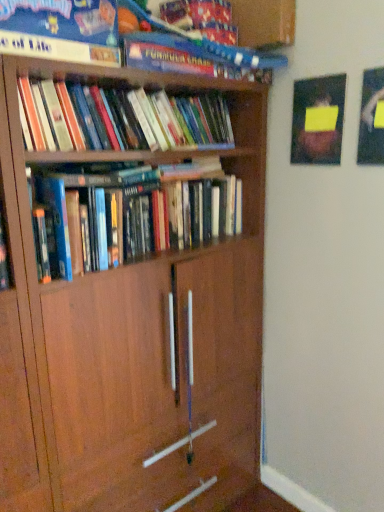
Question: Which direction should I rotate to face hardcover books at center, which is the third book in top-to-bottom order, — up or down?

Choices:
 (A) down
 (B) up

Answer: (B)

Question: Can you confirm if hardcover book at upper center, which is the 1th book in top-to-bottom order, is positioned to the right of hardcover books at upper left, which is counted as the second book, starting from the top?

Choices:
 (A) no
 (B) yes

Answer: (B)

Question: Are hardcover book at upper center, the third book in the bottom-to-top sequence, and hardcover books at upper left, the second book in the bottom-to-top sequence, far apart?

Choices:
 (A) yes
 (B) no

Answer: (B)

Question: Considering the relative sizes of hardcover book at upper center, the third book in the bottom-to-top sequence, and hardcover books at upper left, the second book in the bottom-to-top sequence, in the image provided, is hardcover book at upper center, the third book in the bottom-to-top sequence, smaller than hardcover books at upper left, the second book in the bottom-to-top sequence,?

Choices:
 (A) no
 (B) yes

Answer: (A)

Question: Considering the relative sizes of hardcover book at upper center, the third book in the bottom-to-top sequence, and hardcover books at upper left, which is counted as the second book, starting from the top, in the image provided, is hardcover book at upper center, the third book in the bottom-to-top sequence, wider than hardcover books at upper left, which is counted as the second book, starting from the top,?

Choices:
 (A) no
 (B) yes

Answer: (B)

Question: From a real-world perspective, is hardcover book at upper center, which is the 1th book in top-to-bottom order, physically below hardcover books at upper left, the second book in the bottom-to-top sequence?

Choices:
 (A) no
 (B) yes

Answer: (A)

Question: Considering the relative sizes of hardcover book at upper center, the third book in the bottom-to-top sequence, and hardcover books at upper left, the second book in the bottom-to-top sequence, in the image provided, is hardcover book at upper center, the third book in the bottom-to-top sequence, thinner than hardcover books at upper left, the second book in the bottom-to-top sequence,?

Choices:
 (A) no
 (B) yes

Answer: (A)

Question: Is hardcover books at center, which is the third book in top-to-bottom order, not inside hardcover book at upper center, which is the 1th book in top-to-bottom order?

Choices:
 (A) no
 (B) yes

Answer: (B)

Question: From the image's perspective, does hardcover books at center, which ranks as the first book in bottom-to-top order, appear lower than hardcover book at upper center, the third book in the bottom-to-top sequence?

Choices:
 (A) no
 (B) yes

Answer: (B)

Question: Are hardcover books at center, which ranks as the first book in bottom-to-top order, and hardcover book at upper center, the third book in the bottom-to-top sequence, located far from each other?

Choices:
 (A) no
 (B) yes

Answer: (A)

Question: Is hardcover books at center, which ranks as the first book in bottom-to-top order, positioned with its back to hardcover book at upper center, which is the 1th book in top-to-bottom order?

Choices:
 (A) yes
 (B) no

Answer: (B)

Question: Does hardcover books at center, which ranks as the first book in bottom-to-top order, appear on the left side of hardcover book at upper center, which is the 1th book in top-to-bottom order?

Choices:
 (A) no
 (B) yes

Answer: (A)

Question: From a real-world perspective, is hardcover books at center, which ranks as the first book in bottom-to-top order, beneath hardcover book at upper center, which is the 1th book in top-to-bottom order?

Choices:
 (A) no
 (B) yes

Answer: (B)

Question: Does hardcover book at upper center, the third book in the bottom-to-top sequence, have a smaller size compared to hardcover books at center, which ranks as the first book in bottom-to-top order?

Choices:
 (A) no
 (B) yes

Answer: (B)